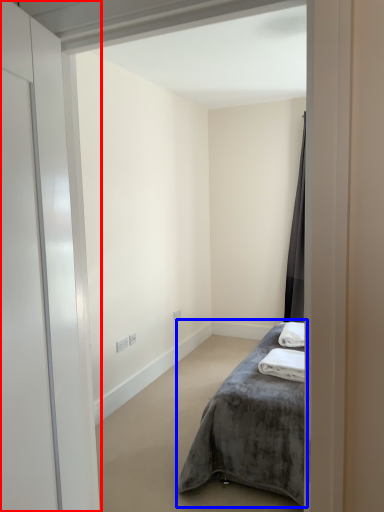
Question: Which of the following is the closest to the observer, door (highlighted by a red box) or bed (highlighted by a blue box)?

Choices:
 (A) door
 (B) bed

Answer: (A)